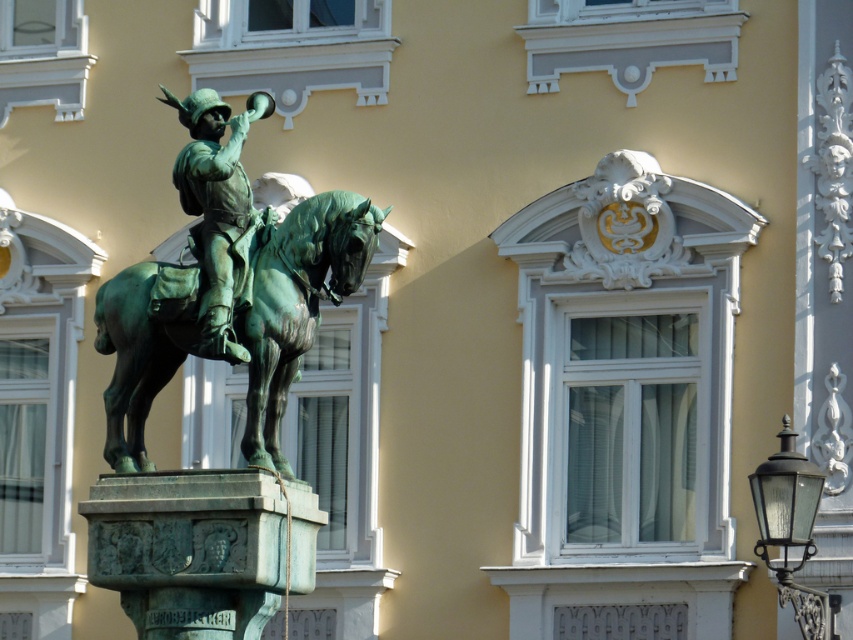
Question: Which of the following is the closest to the observer?

Choices:
 (A) bronze statue at center
 (B) green patina horse at center

Answer: (B)

Question: Considering the relative positions of green patina horse at center and bronze statue at center in the image provided, where is green patina horse at center located with respect to bronze statue at center?

Choices:
 (A) below
 (B) above

Answer: (A)

Question: Can you confirm if green patina horse at center is wider than bronze statue at center?

Choices:
 (A) yes
 (B) no

Answer: (A)

Question: Can you confirm if green patina horse at center is thinner than bronze statue at center?

Choices:
 (A) no
 (B) yes

Answer: (A)